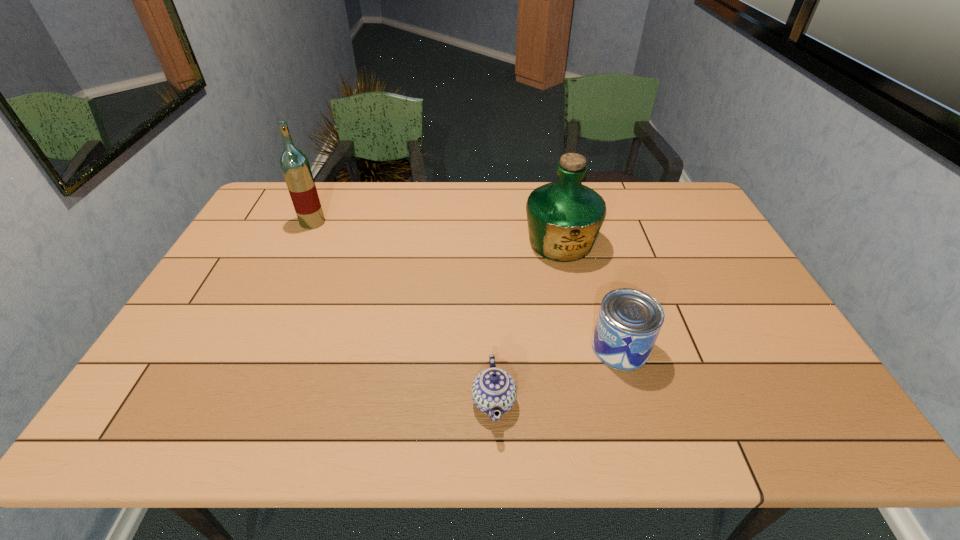
What are the coordinates of `vacant space at the near left corner of the desktop` in the screenshot? It's located at (138, 438).

In the image, there is a desktop. Where is `vacant area at the far right corner`? vacant area at the far right corner is located at coordinates (670, 213).

Where is `free space between the chinaware and the can`? The width and height of the screenshot is (960, 540). free space between the chinaware and the can is located at coordinates (557, 374).

Identify the location of vacant area that lies between the can and the left liquor. The image size is (960, 540). (467, 285).

This screenshot has width=960, height=540. Identify the location of vacant area that lies between the shorter liquor and the left liquor. (437, 233).

At what (x,y) coordinates should I click in order to perform the action: click on vacant space that's between the right liquor and the tallest object. Please return your answer as a coordinate pair (x, y). Image resolution: width=960 pixels, height=540 pixels. Looking at the image, I should click on (437, 233).

This screenshot has height=540, width=960. I want to click on vacant space that is in between the tallest object and the shorter liquor, so pos(437,233).

This screenshot has width=960, height=540. I want to click on free space between the shortest object and the tallest object, so click(x=403, y=312).

Identify the location of free spot between the tallest object and the chinaware. (403, 312).

You are a GUI agent. You are given a task and a screenshot of the screen. Output one action in this format:
    pyautogui.click(x=<x>, y=<y>)
    Task: Click on the free space between the can and the shorter liquor
    The height and width of the screenshot is (540, 960).
    Given the screenshot: What is the action you would take?
    pyautogui.click(x=590, y=295)